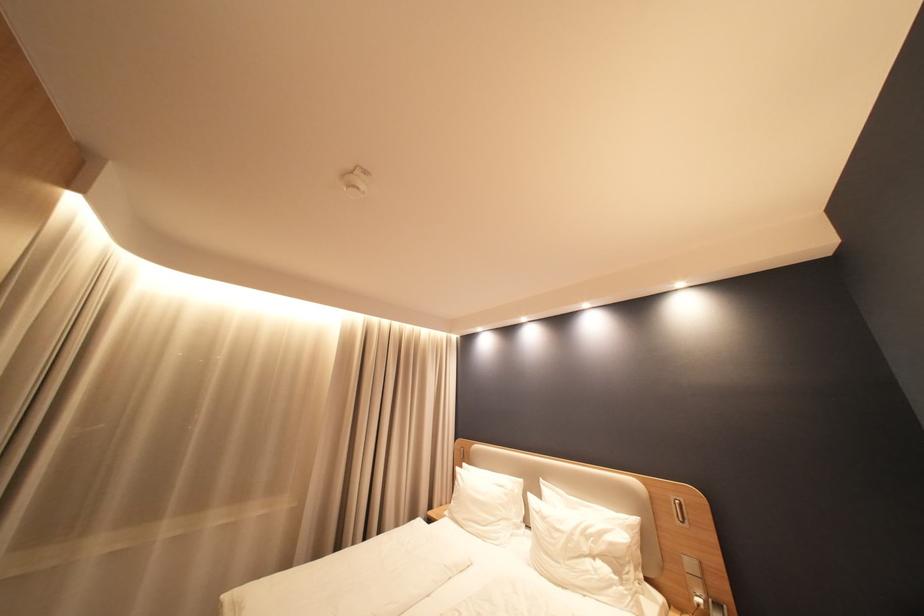
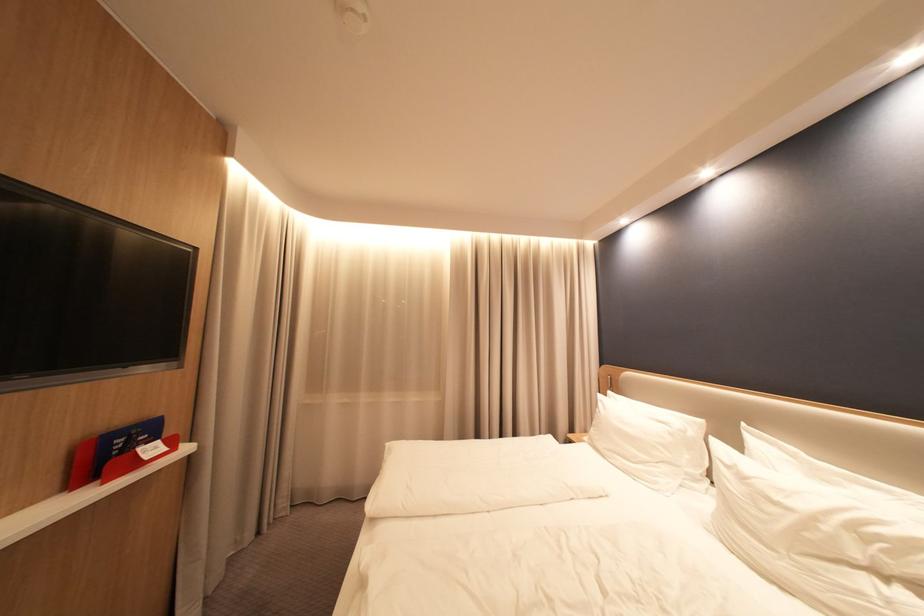
Question: Based on the continuous images, in which direction is the camera rotating? Reply with the corresponding letter.

Choices:
 (A) Left
 (B) Right
 (C) Up
 (D) Down

Answer: (A)